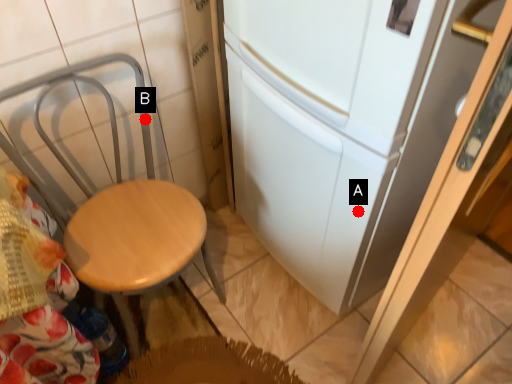
Question: Two points are circled on the image, labeled by A and B beside each circle. Which point appears farthest from the camera in this image?

Choices:
 (A) A is further
 (B) B is further

Answer: (B)